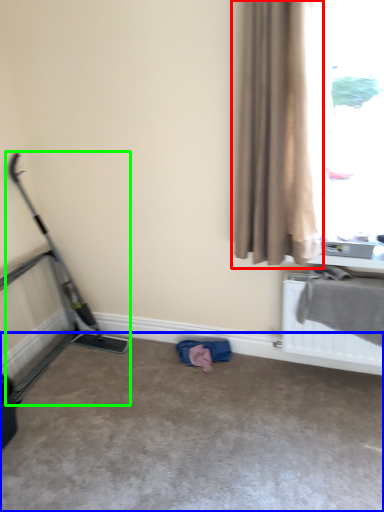
Question: Which object is the farthest from curtain (highlighted by a red box)? Choose among these: concrete (highlighted by a blue box) or baby carriage (highlighted by a green box).

Choices:
 (A) concrete
 (B) baby carriage

Answer: (B)